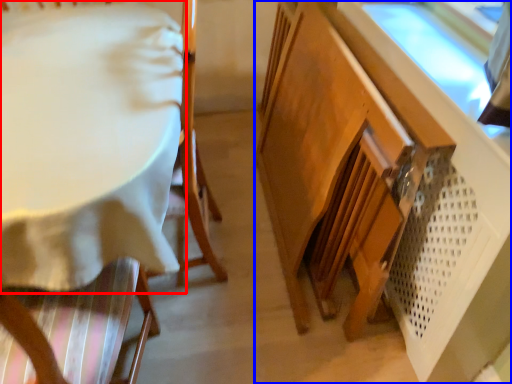
Question: Which point is further to the camera, table (highlighted by a red box) or cabinetry (highlighted by a blue box)?

Choices:
 (A) table
 (B) cabinetry

Answer: (A)